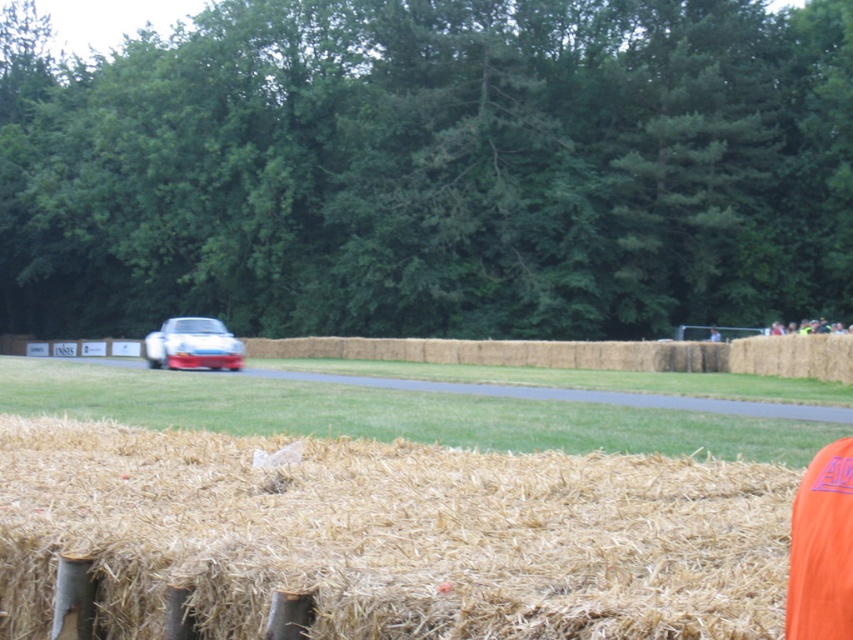
Can you confirm if smooth asphalt road at center is positioned to the left of white glossy car at center?

No, smooth asphalt road at center is not to the left of white glossy car at center.

Based on the photo, is smooth asphalt road at center closer to camera compared to white glossy car at center?

Yes, smooth asphalt road at center is in front of white glossy car at center.

What are the coordinates of `smooth asphalt road at center` in the screenshot? It's located at (556, 380).

Is straw bales at lower center bigger than smooth asphalt road at center?

No.

Which of these two, straw bales at lower center or smooth asphalt road at center, stands shorter?

Standing shorter between the two is straw bales at lower center.

Does point (131, 435) come behind point (728, 408)?

No.

Locate an element on the screen. Image resolution: width=853 pixels, height=640 pixels. straw bales at lower center is located at coordinates (389, 536).

Consider the image. Can you confirm if straw bales at lower center is wider than white glossy car at center?

Incorrect, straw bales at lower center's width does not surpass white glossy car at center's.

Can you confirm if straw bales at lower center is positioned below white glossy car at center?

Indeed, straw bales at lower center is positioned under white glossy car at center.

This screenshot has width=853, height=640. What do you see at coordinates (389, 536) in the screenshot?
I see `straw bales at lower center` at bounding box center [389, 536].

Identify the location of straw bales at lower center. (389, 536).